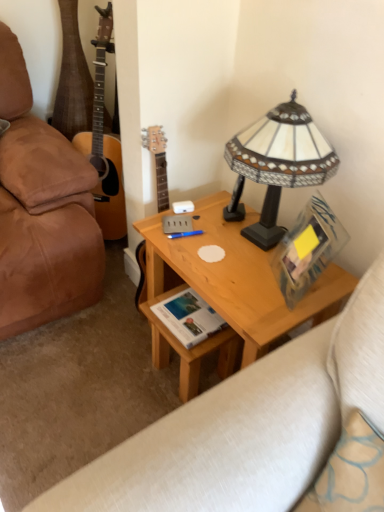
This screenshot has height=512, width=384. I want to click on empty space that is ontop of white paper book at center (from a real-world perspective), so click(191, 311).